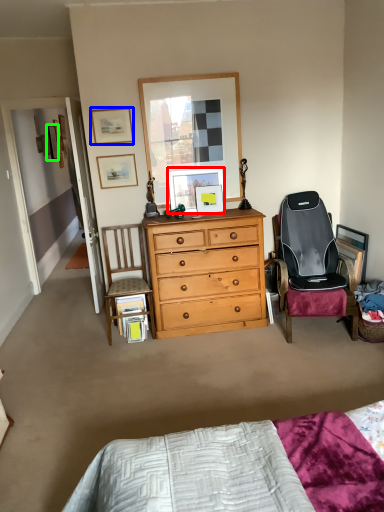
Question: Considering the real-world distances, which object is farthest from picture frame (highlighted by a red box)? picture frame (highlighted by a blue box) or picture frame (highlighted by a green box)?

Choices:
 (A) picture frame
 (B) picture frame

Answer: (B)